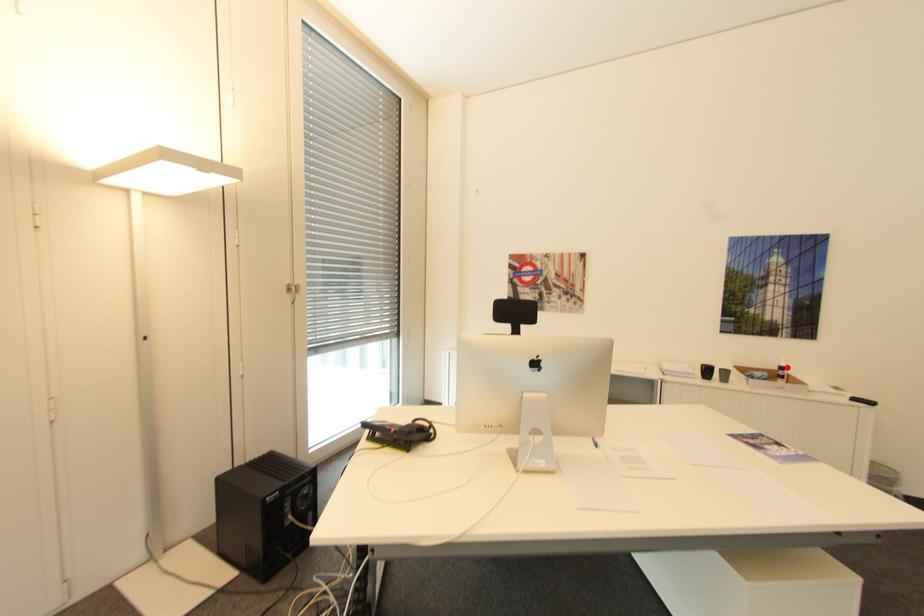
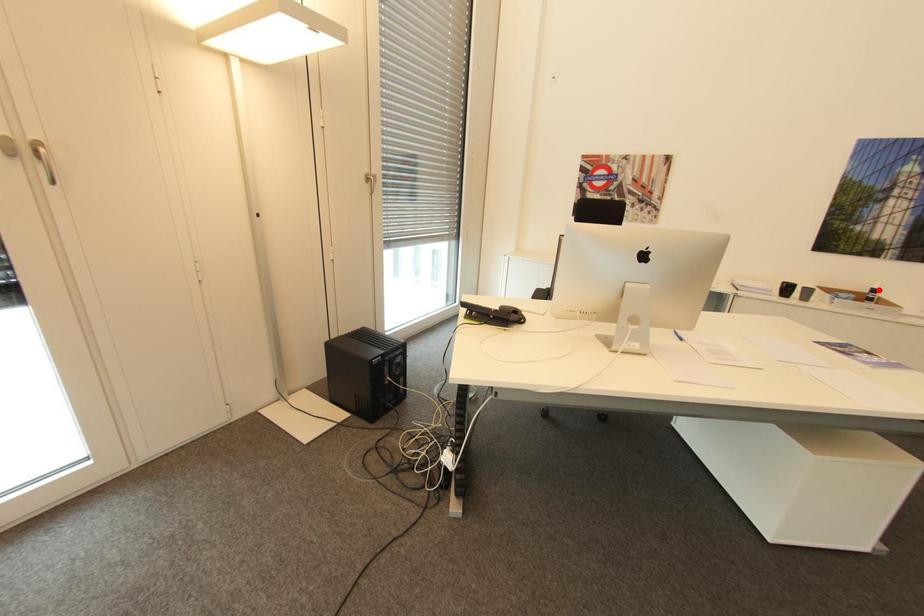
I am providing you with two images of the same scene from different viewpoints. A red point is marked on the first image and another point is marked on the second image. Are the points marked in image1 and image2 representing the same 3D position?

Yes